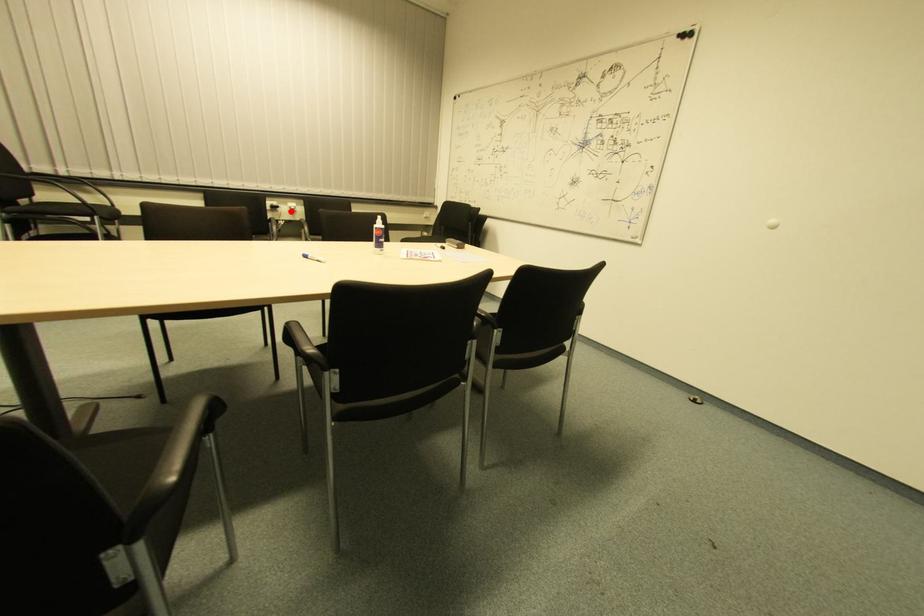
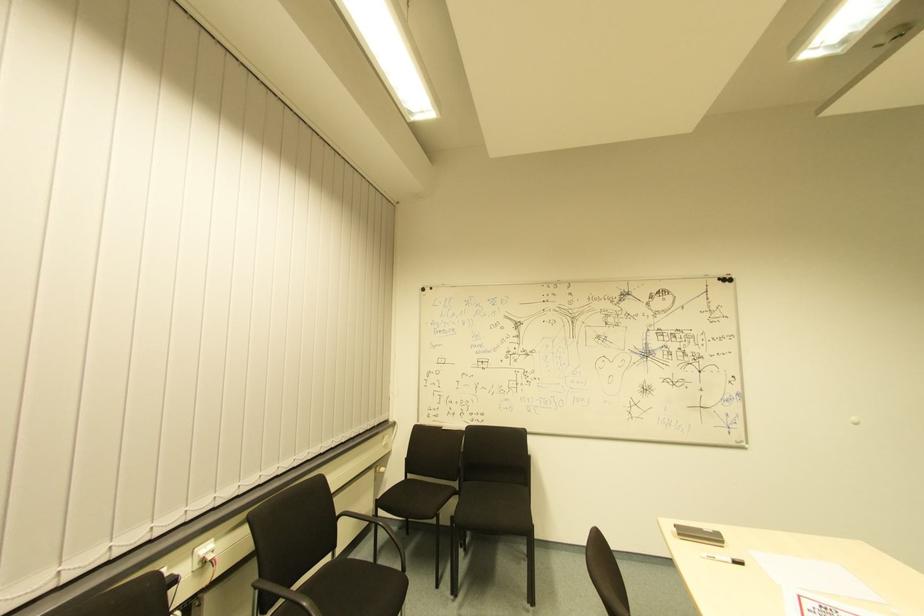
The point at the highlighted location is marked in the first image. Where is the corresponding point in the second image?

(208, 561)